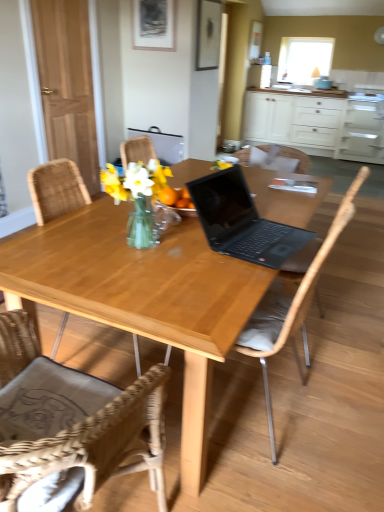
Describe the element at coordinates (296, 158) in the screenshot. I see `wooden chair at center, which is the third chair from front to back` at that location.

Where is `woven rattan chair at lower left, positioned as the 1th chair in front-to-back order`? woven rattan chair at lower left, positioned as the 1th chair in front-to-back order is located at coordinates (70, 426).

I want to click on white matte cabinet at upper right, so click(x=316, y=124).

Identify the location of the 2nd chair in front of the black matte laptop at center. Image resolution: width=384 pixels, height=512 pixels. (70, 426).

Is woven rattan chair at lower left, which ranks as the third chair in back-to-front order, looking in the opposite direction of black matte laptop at center?

No, woven rattan chair at lower left, which ranks as the third chair in back-to-front order, is not facing away from black matte laptop at center.

How different are the orientations of woven rattan chair at lower left, positioned as the 1th chair in front-to-back order, and black matte laptop at center in degrees?

The facing directions of woven rattan chair at lower left, positioned as the 1th chair in front-to-back order, and black matte laptop at center are 94.6 degrees apart.

From the image's perspective, which object appears higher, woven rattan chair at lower left, positioned as the 1th chair in front-to-back order, or black matte laptop at center?

From the image's view, black matte laptop at center is above.

Considering the sizes of objects matte black picture frame at upper center, which appears as the second picture frame when viewed from the right, and wooden chair at center, which is the first chair in back-to-front order, in the image provided, who is bigger, matte black picture frame at upper center, which appears as the second picture frame when viewed from the right, or wooden chair at center, which is the first chair in back-to-front order,?

With larger size is wooden chair at center, which is the first chair in back-to-front order.

Considering the positions of point (138, 4) and point (292, 154), is point (138, 4) closer or farther from the camera than point (292, 154)?

Point (138, 4) appears to be farther away from the viewer than point (292, 154).

Relative to wooden chair at center, which is the third chair from front to back, is matte black picture frame at upper center, which is the first picture frame in left-to-right order, in front or behind?

In the image, matte black picture frame at upper center, which is the first picture frame in left-to-right order, appears behind wooden chair at center, which is the third chair from front to back.

Looking at this image, is matte black picture frame at upper center, which is the first picture frame in left-to-right order, at the right side of wooden chair at center, which is the first chair in back-to-front order?

No.

Which is behind, point (24, 269) or point (207, 67)?

The point (207, 67) is farther from the camera.

Is light wood table at center not inside wooden picture frame at upper center, acting as the 1th picture frame starting from the right?

Indeed, light wood table at center is completely outside wooden picture frame at upper center, acting as the 1th picture frame starting from the right.

Between light wood table at center and wooden picture frame at upper center, acting as the 1th picture frame starting from the right, which one appears on the left side from the viewer's perspective?

Positioned to the left is light wood table at center.

Which object is wider, light wood table at center or wooden picture frame at upper center, acting as the 1th picture frame starting from the right?

light wood table at center is wider.

From a real-world perspective, which chair is the 2nd one underneath the transparent glass window screen at upper center? Please provide its 2D coordinates.

[(292, 304)]

Is wooden chair at center, which is counted as the 2th chair, starting from the back, not within transparent glass window screen at upper center?

wooden chair at center, which is counted as the 2th chair, starting from the back, lies outside transparent glass window screen at upper center's area.

Between wooden chair at center, which is counted as the 2th chair, starting from the back, and transparent glass window screen at upper center, which one appears on the left side from the viewer's perspective?

From the viewer's perspective, wooden chair at center, which is counted as the 2th chair, starting from the back, appears more on the left side.

Considering the relative sizes of wooden chair at center, the second chair in the front-to-back sequence, and transparent glass window screen at upper center in the image provided, is wooden chair at center, the second chair in the front-to-back sequence, wider than transparent glass window screen at upper center?

Correct, the width of wooden chair at center, the second chair in the front-to-back sequence, exceeds that of transparent glass window screen at upper center.

Could you tell me if wooden chair at center, the second chair in the front-to-back sequence, is facing matte white armchair at upper center?

No, wooden chair at center, the second chair in the front-to-back sequence, is not turned towards matte white armchair at upper center.

Does point (337, 226) come closer to viewer compared to point (178, 157)?

That is True.

There is a matte white armchair at upper center. In order to click on the 1st chair above it (from a real-world perspective) in this screenshot , I will do `click(292, 304)`.

Is wooden chair at center, which is counted as the 2th chair, starting from the back, surrounding matte white armchair at upper center?

Definitely not — matte white armchair at upper center is not inside wooden chair at center, which is counted as the 2th chair, starting from the back.

Is black matte laptop at center spatially inside matte black picture frame at upper center, which is the first picture frame in left-to-right order, or outside of it?

black matte laptop at center is spatially situated outside matte black picture frame at upper center, which is the first picture frame in left-to-right order.

Considering the points (256, 218) and (148, 19), which point is behind, point (256, 218) or point (148, 19)?

Positioned behind is point (148, 19).

From the image's perspective, is black matte laptop at center on top of matte black picture frame at upper center, which is the first picture frame in left-to-right order?

Actually, black matte laptop at center appears below matte black picture frame at upper center, which is the first picture frame in left-to-right order, in the image.

Is black matte laptop at center oriented towards matte black picture frame at upper center, which is the first picture frame in left-to-right order?

No, black matte laptop at center is not turned towards matte black picture frame at upper center, which is the first picture frame in left-to-right order.

From the image's perspective, between matte white armchair at upper center and white matte cabinet at upper right, who is located below?

matte white armchair at upper center, from the image's perspective.

Considering the relative positions of matte white armchair at upper center and white matte cabinet at upper right in the image provided, is matte white armchair at upper center to the right of white matte cabinet at upper right from the viewer's perspective?

In fact, matte white armchair at upper center is to the left of white matte cabinet at upper right.

At what (x,y) coordinates should I click in order to perform the action: click on cabinetry on the right of the matte white armchair at upper center. Please return your answer as a coordinate pair (x, y). The image size is (384, 512). Looking at the image, I should click on (316, 124).

Can you tell me how much matte white armchair at upper center and white matte cabinet at upper right differ in facing direction?

The angular difference between matte white armchair at upper center and white matte cabinet at upper right is 0.991 degrees.

What are the coordinates of `laptop above the woven rattan chair at lower left, which ranks as the third chair in back-to-front order (from the image's perspective)` in the screenshot? It's located at (242, 221).

You are a GUI agent. You are given a task and a screenshot of the screen. Output one action in this format:
    pyautogui.click(x=<x>, y=<y>)
    Task: Click on the 1st chair in front of the matte black picture frame at upper center, which appears as the second picture frame when viewed from the right
    This screenshot has height=512, width=384.
    Given the screenshot: What is the action you would take?
    pyautogui.click(x=296, y=158)

Considering their positions, is translucent glass vase at center positioned closer to white matte cabinet at upper right than wooden chair at center, which is counted as the 2th chair, starting from the back?

Among the two, wooden chair at center, which is counted as the 2th chair, starting from the back, is located nearer to white matte cabinet at upper right.

From the image, which object appears to be nearer to matte black picture frame at upper center, which is the first picture frame in left-to-right order, woven rattan chair at lower left, which ranks as the third chair in back-to-front order, or black matte laptop at center?

black matte laptop at center is positioned closer to the anchor matte black picture frame at upper center, which is the first picture frame in left-to-right order.

From the image, which object appears to be nearer to woven rattan chair at lower left, which ranks as the third chair in back-to-front order, black matte laptop at center or white matte cabinet at upper right?

Based on the image, black matte laptop at center appears to be nearer to woven rattan chair at lower left, which ranks as the third chair in back-to-front order.

Looking at the image, which one is located further to matte white armchair at upper center, transparent glass window screen at upper center or translucent glass vase at center?

The object further to matte white armchair at upper center is transparent glass window screen at upper center.

Which object lies nearer to the anchor point transparent glass window screen at upper center, wooden picture frame at upper center, placed as the 2th picture frame when sorted from left to right, or light wood table at center?

wooden picture frame at upper center, placed as the 2th picture frame when sorted from left to right, lies closer to transparent glass window screen at upper center than the other object.

Which object lies nearer to the anchor point woven rattan chair at lower left, which ranks as the third chair in back-to-front order, matte black picture frame at upper center, which appears as the second picture frame when viewed from the right, or transparent glass window screen at upper center?

matte black picture frame at upper center, which appears as the second picture frame when viewed from the right.

From the image, which object appears to be farther from wooden chair at center, which is the third chair from front to back, light wood table at center or woven rattan chair at lower left, positioned as the 1th chair in front-to-back order?

woven rattan chair at lower left, positioned as the 1th chair in front-to-back order.

Which object lies further to the anchor point transparent glass window screen at upper center, translucent glass vase at center or wooden picture frame at upper center, placed as the 2th picture frame when sorted from left to right?

translucent glass vase at center lies further to transparent glass window screen at upper center than the other object.

Locate an element on the screen. The image size is (384, 512). picture frame between matte black picture frame at upper center, which appears as the second picture frame when viewed from the right, and matte white armchair at upper center in the up-down direction is located at coordinates (208, 34).

Where is `chair located between translucent glass vase at center and white matte cabinet at upper right in the depth direction`? The width and height of the screenshot is (384, 512). chair located between translucent glass vase at center and white matte cabinet at upper right in the depth direction is located at coordinates (296, 158).

Where is `floral arrangement between black matte laptop at center and matte black picture frame at upper center, which appears as the second picture frame when viewed from the right, in the front-back direction`? floral arrangement between black matte laptop at center and matte black picture frame at upper center, which appears as the second picture frame when viewed from the right, in the front-back direction is located at coordinates (141, 200).

The height and width of the screenshot is (512, 384). Identify the location of chair between translucent glass vase at center and woven rattan chair at lower left, positioned as the 1th chair in front-to-back order, from top to bottom. (292, 304).